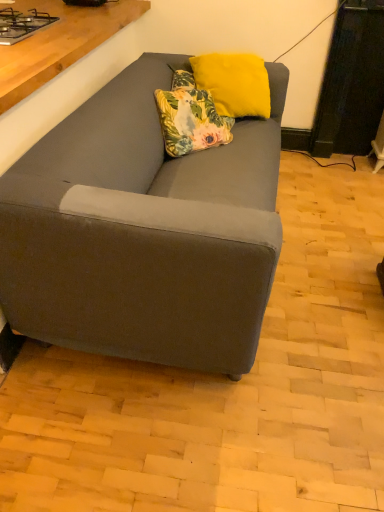
Question: In the image, is floral fabric pillow at center, placed as the 1th pillow when sorted from bottom to top, on the left side or the right side of yellow fuzzy pillow at upper center, which is the 1th pillow in top-to-bottom order?

Choices:
 (A) right
 (B) left

Answer: (B)

Question: In terms of height, does floral fabric pillow at center, placed as the 2th pillow when sorted from top to bottom, look taller or shorter compared to yellow fuzzy pillow at upper center, which is the 1th pillow in top-to-bottom order?

Choices:
 (A) short
 (B) tall

Answer: (A)

Question: Which of these objects is positioned closest to the metallic gray gas stove at upper left?

Choices:
 (A) yellow fuzzy pillow at upper center, the second pillow ordered from the bottom
 (B) floral fabric pillow at center, placed as the 2th pillow when sorted from top to bottom

Answer: (B)

Question: Based on their relative distances, which object is farther from the yellow fuzzy pillow at upper center, the second pillow ordered from the bottom?

Choices:
 (A) floral fabric pillow at center, placed as the 2th pillow when sorted from top to bottom
 (B) metallic gray gas stove at upper left

Answer: (B)